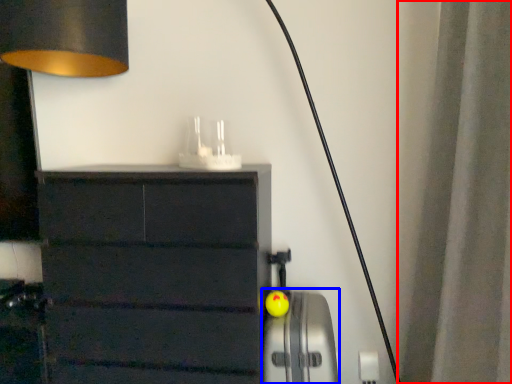
Question: Among these objects, which one is nearest to the camera, curtain (highlighted by a red box) or appliance (highlighted by a blue box)?

Choices:
 (A) curtain
 (B) appliance

Answer: (A)